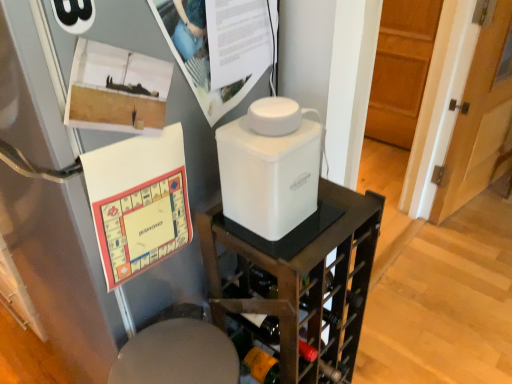
Where is `vacant area that is situated to the right of white plastic container at center`? The image size is (512, 384). vacant area that is situated to the right of white plastic container at center is located at coordinates (342, 216).